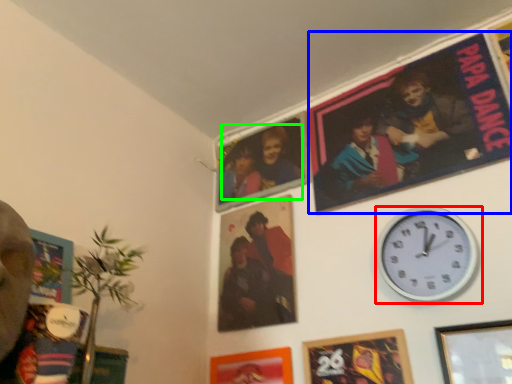
Question: Which object is the farthest from wall clock (highlighted by a red box)? Choose among these: movie poster (highlighted by a blue box) or couple (highlighted by a green box).

Choices:
 (A) movie poster
 (B) couple

Answer: (B)